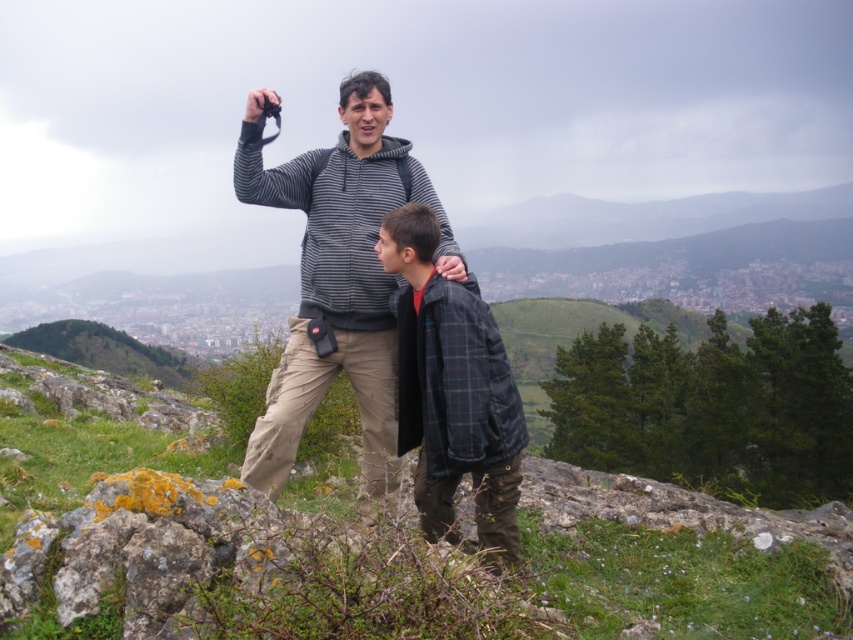
Question: Does striped hoodie at center come behind plaid wool jacket at center?

Choices:
 (A) yes
 (B) no

Answer: (A)

Question: Can you confirm if striped hoodie at center is positioned below plaid wool jacket at center?

Choices:
 (A) no
 (B) yes

Answer: (A)

Question: Does striped hoodie at center appear on the right side of plaid wool jacket at center?

Choices:
 (A) no
 (B) yes

Answer: (A)

Question: Which of the following is the farthest from the observer?

Choices:
 (A) (328, 156)
 (B) (424, 237)

Answer: (A)